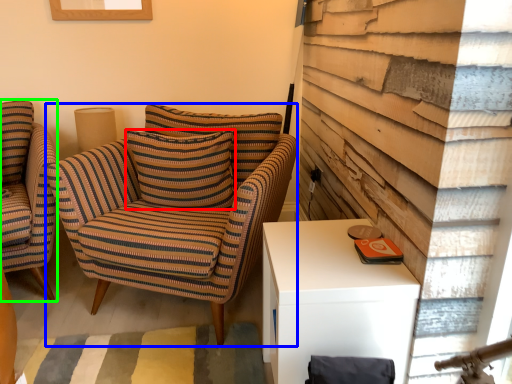
Question: Which object is the farthest from pillow (highlighted by a red box)? Choose among these: chair (highlighted by a blue box) or chair (highlighted by a green box).

Choices:
 (A) chair
 (B) chair

Answer: (B)